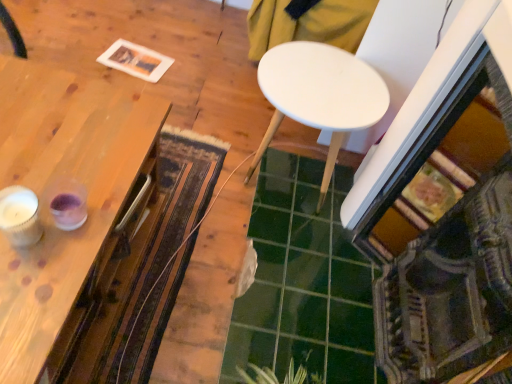
This screenshot has width=512, height=384. What are the coordinates of `vacant location behind white textured candle at left` in the screenshot? It's located at (63, 166).